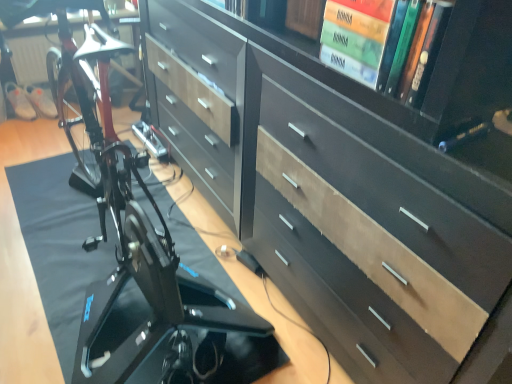
Question: Is black glossy bicycle at lower left outside of dark wood chest of drawers at center?

Choices:
 (A) yes
 (B) no

Answer: (A)

Question: Can you confirm if black glossy bicycle at lower left is positioned to the left of dark wood chest of drawers at center?

Choices:
 (A) yes
 (B) no

Answer: (A)

Question: Is the position of black glossy bicycle at lower left more distant than that of dark wood chest of drawers at center?

Choices:
 (A) yes
 (B) no

Answer: (A)

Question: Does black glossy bicycle at lower left have a larger size compared to dark wood chest of drawers at center?

Choices:
 (A) yes
 (B) no

Answer: (B)

Question: Is black glossy bicycle at lower left wider than dark wood chest of drawers at center?

Choices:
 (A) no
 (B) yes

Answer: (B)

Question: From the image's perspective, is black glossy bicycle at lower left on dark wood chest of drawers at center?

Choices:
 (A) yes
 (B) no

Answer: (B)

Question: From a real-world perspective, is dark wood chest of drawers at center over black glossy bicycle at lower left?

Choices:
 (A) no
 (B) yes

Answer: (B)

Question: Considering the relative sizes of dark wood chest of drawers at center and black glossy bicycle at lower left in the image provided, is dark wood chest of drawers at center wider than black glossy bicycle at lower left?

Choices:
 (A) no
 (B) yes

Answer: (A)

Question: From the image's perspective, is dark wood chest of drawers at center beneath black glossy bicycle at lower left?

Choices:
 (A) yes
 (B) no

Answer: (B)

Question: Can you confirm if dark wood chest of drawers at center is bigger than black glossy bicycle at lower left?

Choices:
 (A) no
 (B) yes

Answer: (B)

Question: From a real-world perspective, is dark wood chest of drawers at center physically below black glossy bicycle at lower left?

Choices:
 (A) no
 (B) yes

Answer: (A)

Question: Is dark wood chest of drawers at center beside black glossy bicycle at lower left?

Choices:
 (A) yes
 (B) no

Answer: (B)

Question: From a real-world perspective, is dark wood chest of drawers at center physically located above or below black glossy bicycle at lower left?

Choices:
 (A) below
 (B) above

Answer: (B)